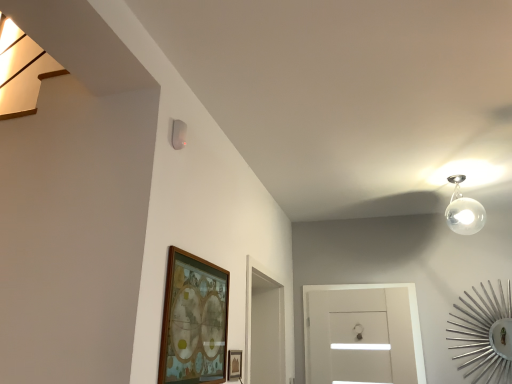
What do you see at coordinates (194, 321) in the screenshot? The width and height of the screenshot is (512, 384). I see `wooden framed artwork at lower center, the first picture frame when ordered from left to right` at bounding box center [194, 321].

What do you see at coordinates (234, 364) in the screenshot? I see `wooden picture frame at lower center, the second picture frame when ordered from left to right` at bounding box center [234, 364].

Describe the element at coordinates (362, 335) in the screenshot. I see `transparent glass door at center` at that location.

Where is `wooden framed artwork at lower center, which appears as the 2th picture frame when viewed from the right`? wooden framed artwork at lower center, which appears as the 2th picture frame when viewed from the right is located at coordinates (194, 321).

Could you tell me if wooden framed artwork at lower center, the first picture frame when ordered from left to right, is turned towards wooden picture frame at lower center, which ranks as the 1th picture frame in right-to-left order?

No.

Which is less distant, (188, 253) or (229, 376)?

Point (188, 253) is closer to the camera than point (229, 376).

What's the angular difference between wooden framed artwork at lower center, the first picture frame when ordered from left to right, and wooden picture frame at lower center, which ranks as the 1th picture frame in right-to-left order,'s facing directions?

They differ by 0.126 degrees in their facing directions.

Based on the photo, which object is thinner, wooden framed artwork at lower center, which appears as the 2th picture frame when viewed from the right, or wooden picture frame at lower center, the second picture frame when ordered from left to right?

wooden picture frame at lower center, the second picture frame when ordered from left to right.

Considering the positions of objects wooden framed artwork at lower center, which appears as the 2th picture frame when viewed from the right, and transparent glass door at center in the image provided, who is behind, wooden framed artwork at lower center, which appears as the 2th picture frame when viewed from the right, or transparent glass door at center?

transparent glass door at center is more distant.

Can we say wooden framed artwork at lower center, the first picture frame when ordered from left to right, lies outside transparent glass door at center?

Yes.

The height and width of the screenshot is (384, 512). In order to click on glass door above the wooden picture frame at lower center, which ranks as the 1th picture frame in right-to-left order (from a real-world perspective) in this screenshot , I will do `click(362, 335)`.

Could you measure the distance between transparent glass door at center and wooden picture frame at lower center, the second picture frame when ordered from left to right?

They are 5.09 feet apart.

Between transparent glass door at center and wooden picture frame at lower center, which ranks as the 1th picture frame in right-to-left order, which one has less height?

With less height is wooden picture frame at lower center, which ranks as the 1th picture frame in right-to-left order.

Is transparent glass door at center in contact with wooden picture frame at lower center, the second picture frame when ordered from left to right?

There is a gap between transparent glass door at center and wooden picture frame at lower center, the second picture frame when ordered from left to right.

Who is more distant, wooden picture frame at lower center, which ranks as the 1th picture frame in right-to-left order, or transparent glass door at center?

transparent glass door at center is further away from the camera.

Does point (234, 354) come closer to viewer compared to point (306, 362)?

Yes, point (234, 354) is closer to viewer.

Are wooden picture frame at lower center, which ranks as the 1th picture frame in right-to-left order, and transparent glass door at center making contact?

No.

What's the angular difference between wooden picture frame at lower center, which ranks as the 1th picture frame in right-to-left order, and wooden framed artwork at lower center, which appears as the 2th picture frame when viewed from the right,'s facing directions?

0.126 degrees separate the facing orientations of wooden picture frame at lower center, which ranks as the 1th picture frame in right-to-left order, and wooden framed artwork at lower center, which appears as the 2th picture frame when viewed from the right.

From their relative heights in the image, would you say wooden picture frame at lower center, which ranks as the 1th picture frame in right-to-left order, is taller or shorter than wooden framed artwork at lower center, the first picture frame when ordered from left to right?

Considering their sizes, wooden picture frame at lower center, which ranks as the 1th picture frame in right-to-left order, has less height than wooden framed artwork at lower center, the first picture frame when ordered from left to right.

Can we say wooden picture frame at lower center, the second picture frame when ordered from left to right, lies outside wooden framed artwork at lower center, the first picture frame when ordered from left to right?

Yes, wooden picture frame at lower center, the second picture frame when ordered from left to right, is not within wooden framed artwork at lower center, the first picture frame when ordered from left to right.

Image resolution: width=512 pixels, height=384 pixels. I want to click on picture frame that appears on the left of wooden picture frame at lower center, which ranks as the 1th picture frame in right-to-left order, so click(x=194, y=321).

Looking at their sizes, would you say transparent glass door at center is wider or thinner than wooden framed artwork at lower center, the first picture frame when ordered from left to right?

transparent glass door at center is wider than wooden framed artwork at lower center, the first picture frame when ordered from left to right.

Looking at this image, could you tell me if transparent glass door at center is facing wooden framed artwork at lower center, which appears as the 2th picture frame when viewed from the right?

Yes.

From the image's perspective, which one is positioned lower, transparent glass door at center or wooden framed artwork at lower center, the first picture frame when ordered from left to right?

transparent glass door at center, from the image's perspective.

Considering their positions, is transparent glass door at center located in front of or behind wooden framed artwork at lower center, the first picture frame when ordered from left to right?

Visually, transparent glass door at center is located behind wooden framed artwork at lower center, the first picture frame when ordered from left to right.

Image resolution: width=512 pixels, height=384 pixels. Identify the location of picture frame lying on the right of wooden framed artwork at lower center, the first picture frame when ordered from left to right. (234, 364).

Locate an element on the screen. The height and width of the screenshot is (384, 512). picture frame above the transparent glass door at center (from a real-world perspective) is located at coordinates (194, 321).

Based on their spatial positions, is transparent glass door at center or wooden picture frame at lower center, which ranks as the 1th picture frame in right-to-left order, further from wooden framed artwork at lower center, the first picture frame when ordered from left to right?

transparent glass door at center is positioned further to the anchor wooden framed artwork at lower center, the first picture frame when ordered from left to right.

Looking at the image, which one is located closer to wooden picture frame at lower center, the second picture frame when ordered from left to right, transparent glass door at center or wooden framed artwork at lower center, which appears as the 2th picture frame when viewed from the right?

wooden framed artwork at lower center, which appears as the 2th picture frame when viewed from the right, is closer to wooden picture frame at lower center, the second picture frame when ordered from left to right.

Based on the photo, looking at the image, which one is located further to transparent glass door at center, wooden framed artwork at lower center, the first picture frame when ordered from left to right, or wooden picture frame at lower center, the second picture frame when ordered from left to right?

Among the two, wooden framed artwork at lower center, the first picture frame when ordered from left to right, is located further to transparent glass door at center.

Consider the image. Looking at the image, which one is located further to wooden picture frame at lower center, the second picture frame when ordered from left to right, wooden framed artwork at lower center, the first picture frame when ordered from left to right, or transparent glass door at center?

The object further to wooden picture frame at lower center, the second picture frame when ordered from left to right, is transparent glass door at center.

Considering their positions, is wooden picture frame at lower center, the second picture frame when ordered from left to right, positioned closer to wooden framed artwork at lower center, which appears as the 2th picture frame when viewed from the right, than transparent glass door at center?

wooden picture frame at lower center, the second picture frame when ordered from left to right, lies closer to wooden framed artwork at lower center, which appears as the 2th picture frame when viewed from the right, than the other object.

When comparing their distances from transparent glass door at center, does wooden picture frame at lower center, which ranks as the 1th picture frame in right-to-left order, or wooden framed artwork at lower center, which appears as the 2th picture frame when viewed from the right, seem further?

wooden framed artwork at lower center, which appears as the 2th picture frame when viewed from the right, is positioned further to the anchor transparent glass door at center.

Identify the location of picture frame between wooden framed artwork at lower center, which appears as the 2th picture frame when viewed from the right, and transparent glass door at center in the front-back direction. Image resolution: width=512 pixels, height=384 pixels. (234, 364).